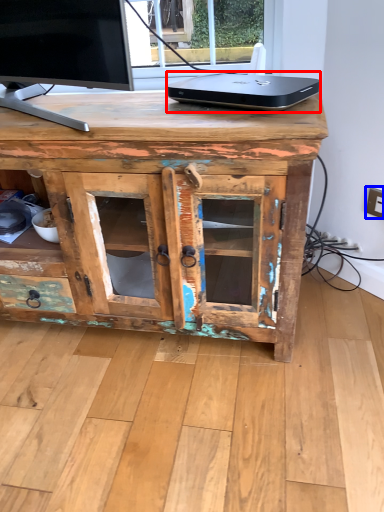
Question: Which of the following is the farthest to the observer, laptop (highlighted by a red box) or electric outlet (highlighted by a blue box)?

Choices:
 (A) laptop
 (B) electric outlet

Answer: (B)